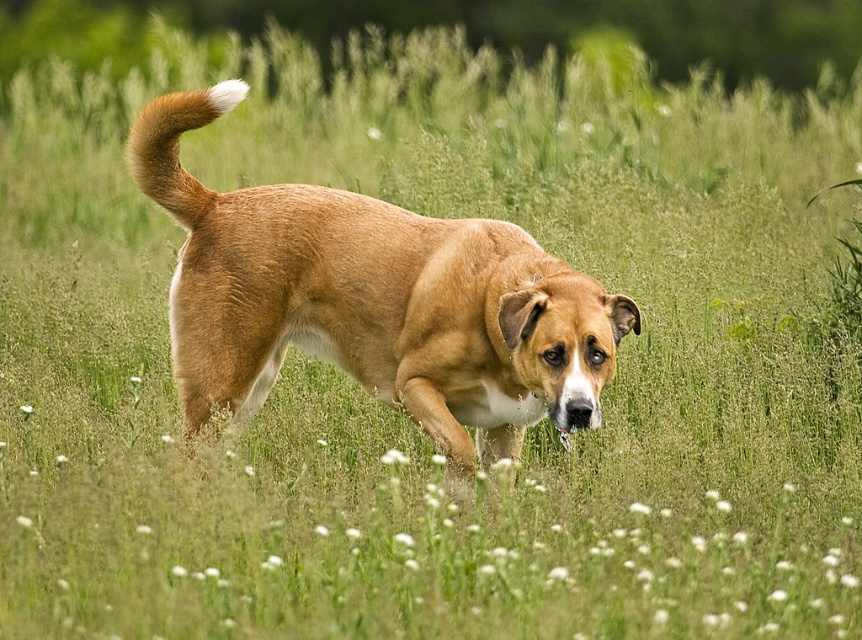
Is golden fur dog at center taller than white fluffy flower at center?

Correct, golden fur dog at center is much taller as white fluffy flower at center.

Is point (484, 452) closer to viewer compared to point (22, 408)?

Yes.

Consider the image. Who is more distant from viewer, (479, 410) or (23, 412)?

Point (23, 412)

Locate an element on the screen. The height and width of the screenshot is (640, 862). golden fur dog at center is located at coordinates (372, 300).

Is golden fur tail at upper left to the left of white fluffy flower at center from the viewer's perspective?

In fact, golden fur tail at upper left is to the right of white fluffy flower at center.

Can you confirm if golden fur tail at upper left is shorter than white fluffy flower at center?

In fact, golden fur tail at upper left may be taller than white fluffy flower at center.

Who is more distant from viewer, (172,166) or (19,406)?

The point (19,406) is behind.

You are a GUI agent. You are given a task and a screenshot of the screen. Output one action in this format:
    pyautogui.click(x=<x>, y=<y>)
    Task: Click on the golden fur tail at upper left
    
    Given the screenshot: What is the action you would take?
    pyautogui.click(x=176, y=147)

Identify the location of golden fur dog at center. (372, 300).

Is golden fur dog at center closer to the viewer compared to golden fur tail at upper left?

That is True.

Describe the element at coordinates (372, 300) in the screenshot. I see `golden fur dog at center` at that location.

Where is `golden fur dog at center`? This screenshot has height=640, width=862. golden fur dog at center is located at coordinates (372, 300).